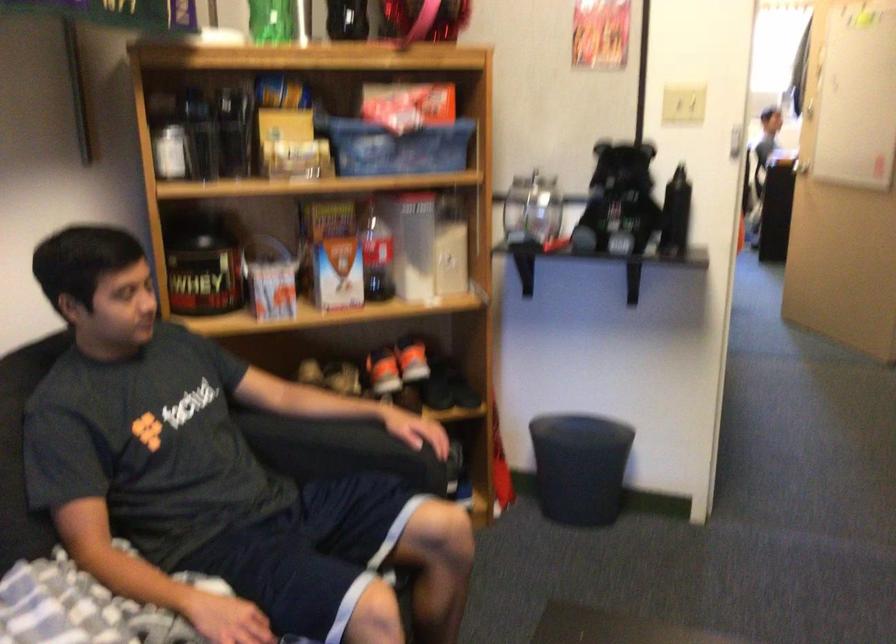
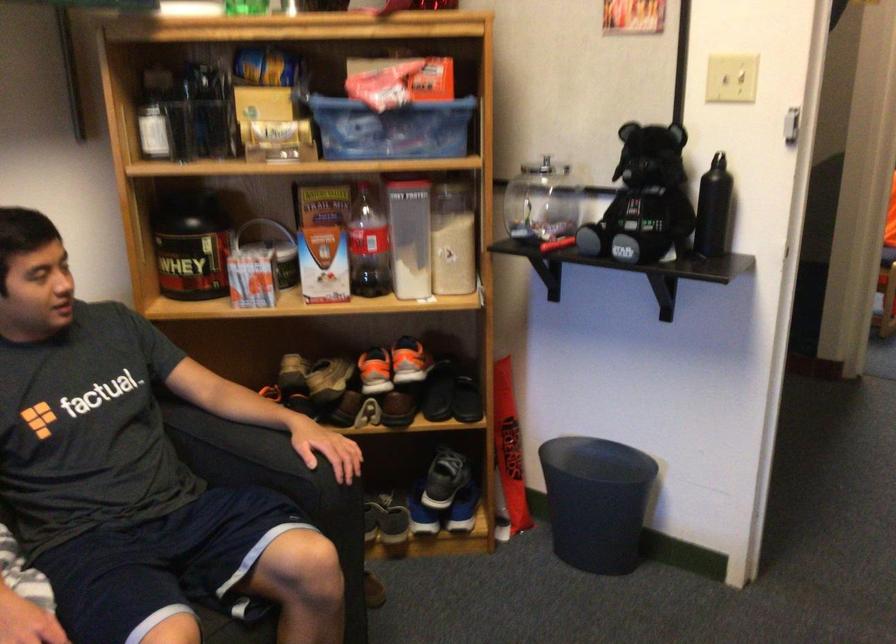
Find the pixel in the second image that matches the point at 409,192 in the first image.

(405, 178)